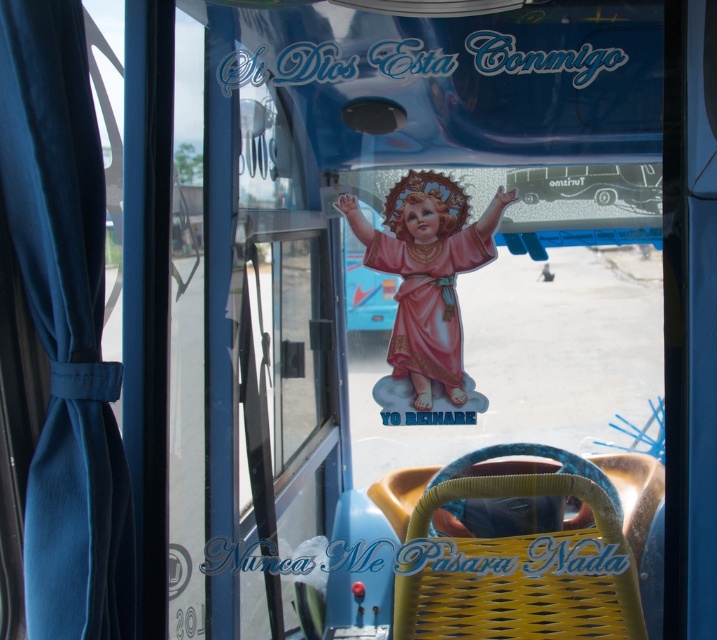
You are a passenger on the bus and notice the yellow woven basket at lower center and the matte pink doll at center. Which object is positioned lower in the scene?

The yellow woven basket at lower center is positioned below the matte pink doll at center, so it is lower in the scene.

You are a passenger on the bus and you want to place your small backpack between the yellow woven basket at lower center and the matte pink doll at center. Can you do this without moving either object?

The yellow woven basket at lower center is closer to the viewer than the matte pink doll at center, so you can place your backpack between them by positioning it in front of the matte pink doll at center but behind the yellow woven basket at lower center.

Looking at this image, you are a passenger on the bus and want to place a small bag in the closest object to you. Which object should you choose between the teal fabric curtain at left and the yellow woven basket at lower center?

The teal fabric curtain at left is closer to the viewer than the yellow woven basket at lower center, so you should place your small bag on the teal fabric curtain at left.